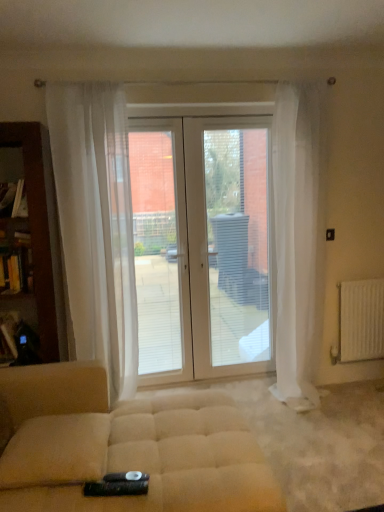
At what (x,y) coordinates should I click in order to perform the action: click on spots to the right of white sheer curtain at right, the second curtain viewed from the left. Please return your answer as a coordinate pair (x, y). Looking at the image, I should click on (359, 400).